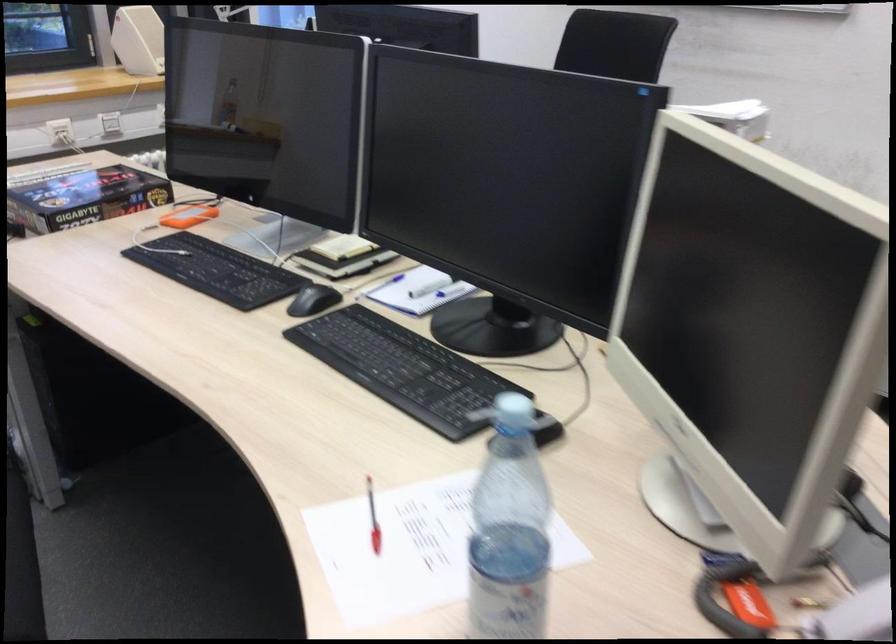
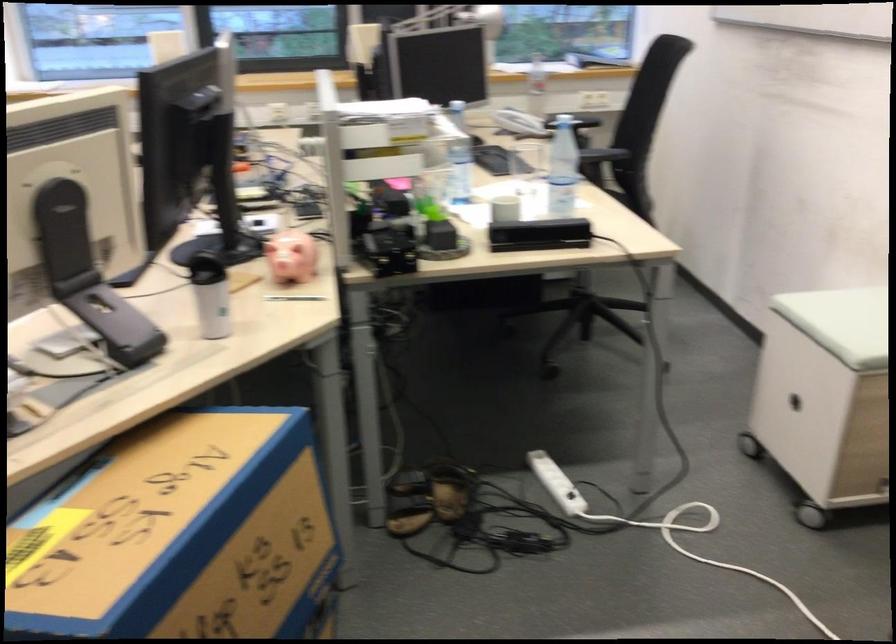
Question: I am providing you with two images of the same scene from different viewpoints. Please identify which objects are invisible in image2.

Choices:
 (A) orange external drive
 (B) pink piggy bank
 (C) stool handle hole
 (D) brown hardcover book

Answer: (A)